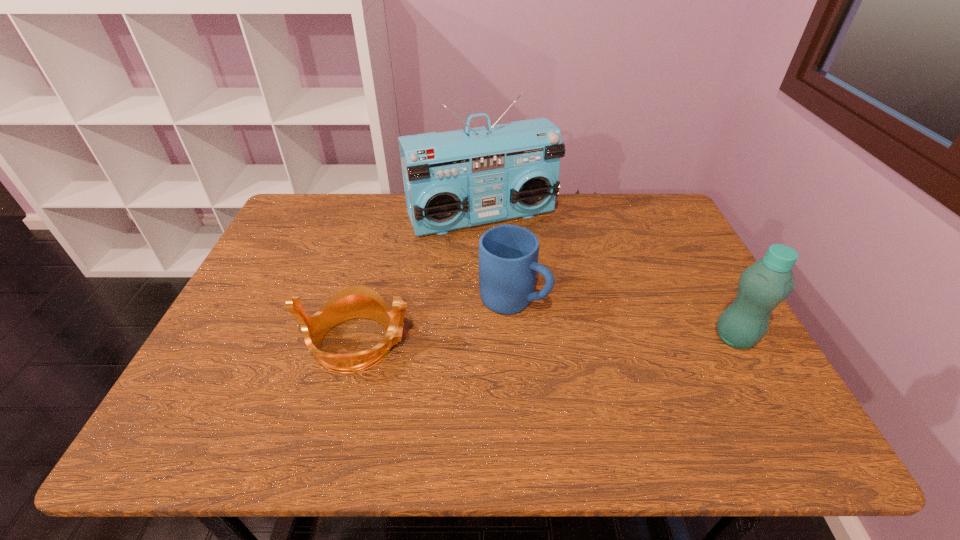
Locate an element on the screen. free space on the desktop that is between the shortest object and the second tallest object and is positioned on the front-facing side of the radio receiver is located at coordinates (x=552, y=340).

The height and width of the screenshot is (540, 960). In order to click on free space on the desktop that is between the tiara and the rightmost object and is positioned on the side of the mug with the handle in this screenshot , I will do `click(582, 340)`.